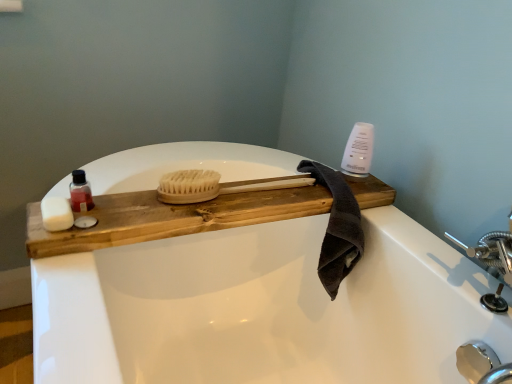
Question: Is white matte soap at left, placed as the first soap when sorted from right to left, smaller than dark gray cotton towel at upper right?

Choices:
 (A) no
 (B) yes

Answer: (B)

Question: From a real-world perspective, does white matte soap at left, placed as the first soap when sorted from right to left, sit lower than dark gray cotton towel at upper right?

Choices:
 (A) yes
 (B) no

Answer: (B)

Question: Is white matte soap at left, placed as the first soap when sorted from right to left, directly adjacent to dark gray cotton towel at upper right?

Choices:
 (A) yes
 (B) no

Answer: (B)

Question: Is white matte soap at left, placed as the first soap when sorted from right to left, located outside dark gray cotton towel at upper right?

Choices:
 (A) no
 (B) yes

Answer: (B)

Question: Does white matte soap at left, marked as the 2th soap in a left-to-right arrangement, have a lesser width compared to dark gray cotton towel at upper right?

Choices:
 (A) no
 (B) yes

Answer: (B)

Question: Does white matte soap at left, marked as the 2th soap in a left-to-right arrangement, turn towards dark gray cotton towel at upper right?

Choices:
 (A) no
 (B) yes

Answer: (A)

Question: Considering the relative sizes of translucent plastic bottle at left and natural wood tray at center in the image provided, is translucent plastic bottle at left wider than natural wood tray at center?

Choices:
 (A) no
 (B) yes

Answer: (A)

Question: Is translucent plastic bottle at left at the left side of natural wood tray at center?

Choices:
 (A) no
 (B) yes

Answer: (B)

Question: Is translucent plastic bottle at left positioned with its back to natural wood tray at center?

Choices:
 (A) yes
 (B) no

Answer: (A)

Question: Does translucent plastic bottle at left come in front of natural wood tray at center?

Choices:
 (A) no
 (B) yes

Answer: (A)

Question: Does translucent plastic bottle at left appear on the right side of natural wood tray at center?

Choices:
 (A) yes
 (B) no

Answer: (B)

Question: Is translucent plastic bottle at left oriented towards natural wood tray at center?

Choices:
 (A) no
 (B) yes

Answer: (A)

Question: Considering the relative positions of white matte soap at left, arranged as the second soap when viewed from the right, and natural wood tray at center in the image provided, is white matte soap at left, arranged as the second soap when viewed from the right, in front of natural wood tray at center?

Choices:
 (A) no
 (B) yes

Answer: (A)